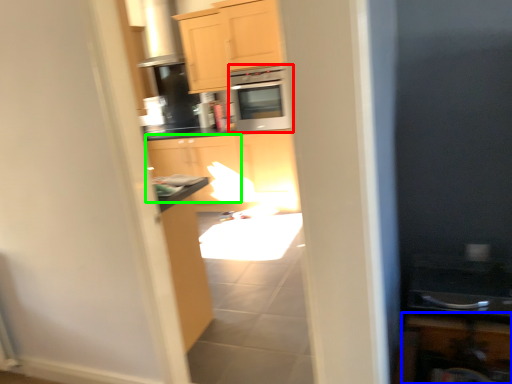
Question: Estimate the real-world distances between objects in this image. Which object is farther from microwave oven (highlighted by a red box), cabinetry (highlighted by a blue box) or cabinetry (highlighted by a green box)?

Choices:
 (A) cabinetry
 (B) cabinetry

Answer: (A)